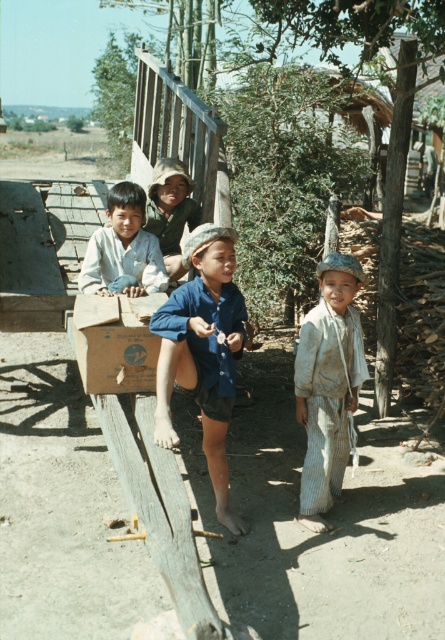
You are a photographer trying to capture a closeup of the light brown striped pants at center and the brown cardboard box at center in the scene. Can you fit both subjects into your camera frame if your camera has a minimum focus distance of 30 inches?

The light brown striped pants at center and brown cardboard box at center are 33.44 inches apart from each other. Since the minimum focus distance is 30 inches, the photographer can capture both subjects in the frame as the distance between them is within the camera requirement.

In the rural scene, there are two children wearing a blue cotton shirt at center and light brown striped pants at center. Which clothing item is bigger in size?

The blue cotton shirt at center is larger in size than the light brown striped pants at center.

You are a photographer trying to capture a closeup of the brown cardboard box at center. The light brown striped pants at center might be blocking your view. Is the box above or below the pants?

The light brown striped pants at center is below the brown cardboard box at center, so the box is above the pants and not blocked.